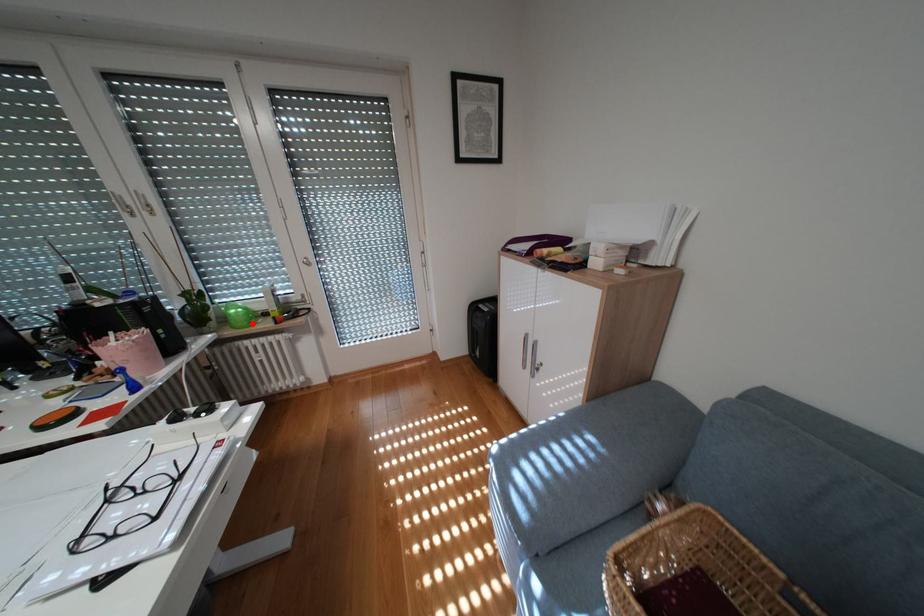
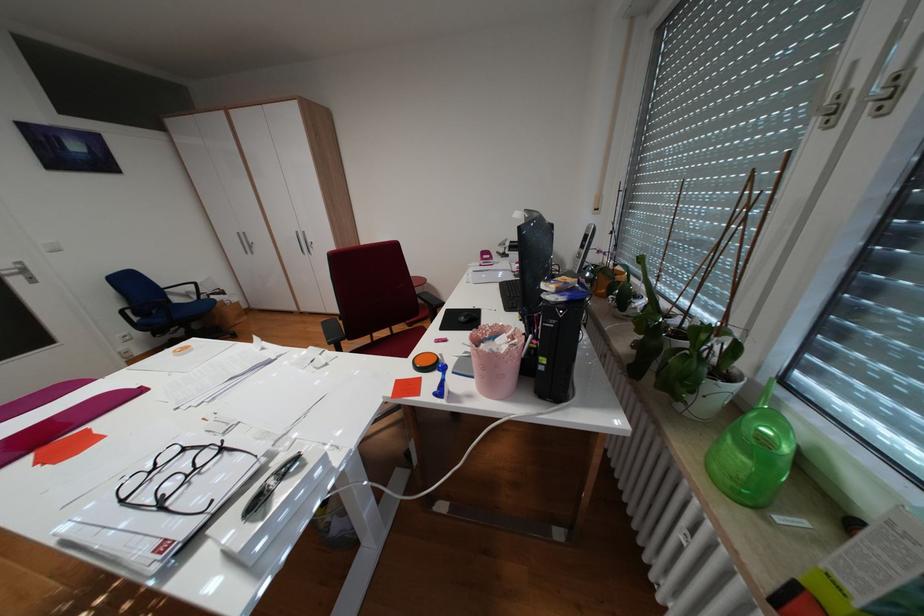
The point at the highlighted location is marked in the first image. Where is the corresponding point in the second image?

(727, 466)